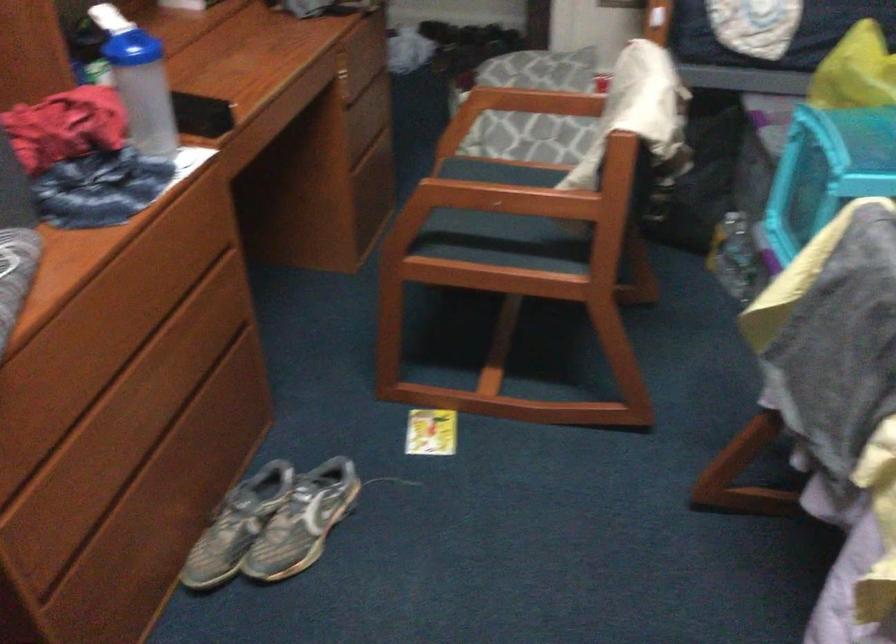
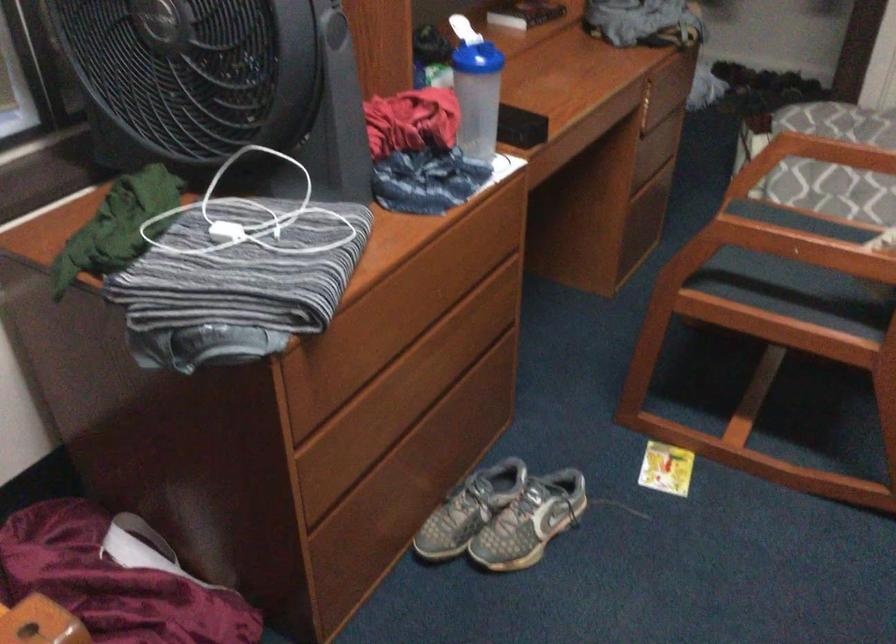
Locate, in the second image, the point that corresponds to (x=142, y=91) in the first image.

(478, 97)